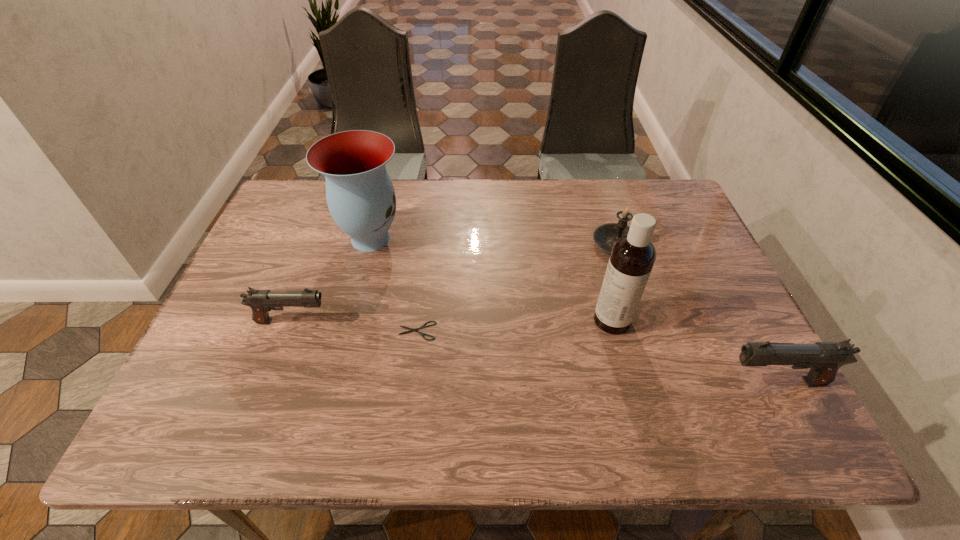
Locate an element on the screen. This screenshot has width=960, height=540. free space that satisfies the following two spatial constraints: 1. on the front side of the vase; 2. in the direction the left gun is aimed is located at coordinates [349, 321].

Find the location of a particular element. The height and width of the screenshot is (540, 960). vacant space that satisfies the following two spatial constraints: 1. on the label side of the dishwasher detergent; 2. on the front side of the shortest object is located at coordinates (614, 331).

You are a GUI agent. You are given a task and a screenshot of the screen. Output one action in this format:
    pyautogui.click(x=<x>, y=<y>)
    Task: Click on the vacant area that satisfies the following two spatial constraints: 1. on the back side of the shortest object; 2. on the left side of the candle
    
    Given the screenshot: What is the action you would take?
    pyautogui.click(x=428, y=244)

Locate an element on the screen. Image resolution: width=960 pixels, height=540 pixels. vacant space that satisfies the following two spatial constraints: 1. on the front side of the vase; 2. on the right side of the candle is located at coordinates (370, 244).